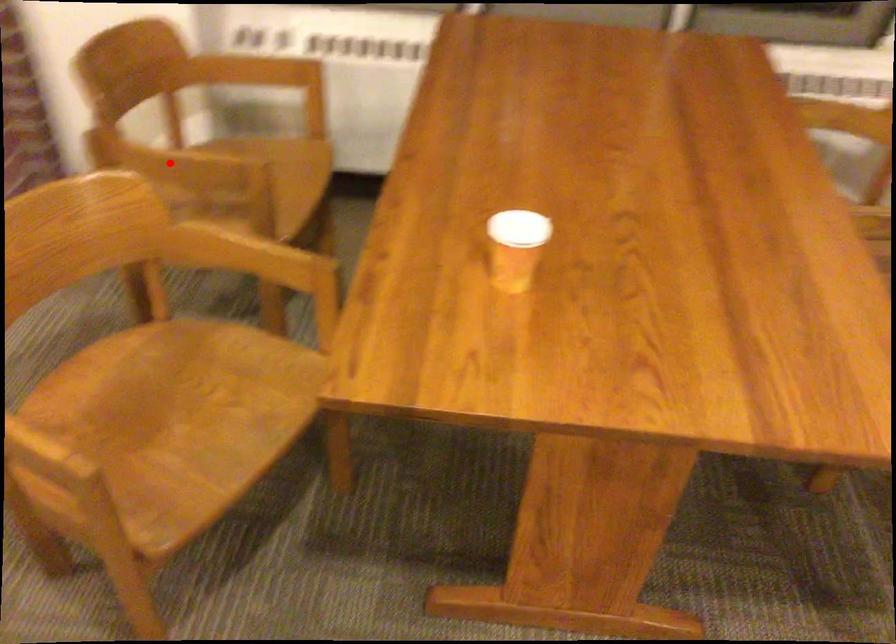
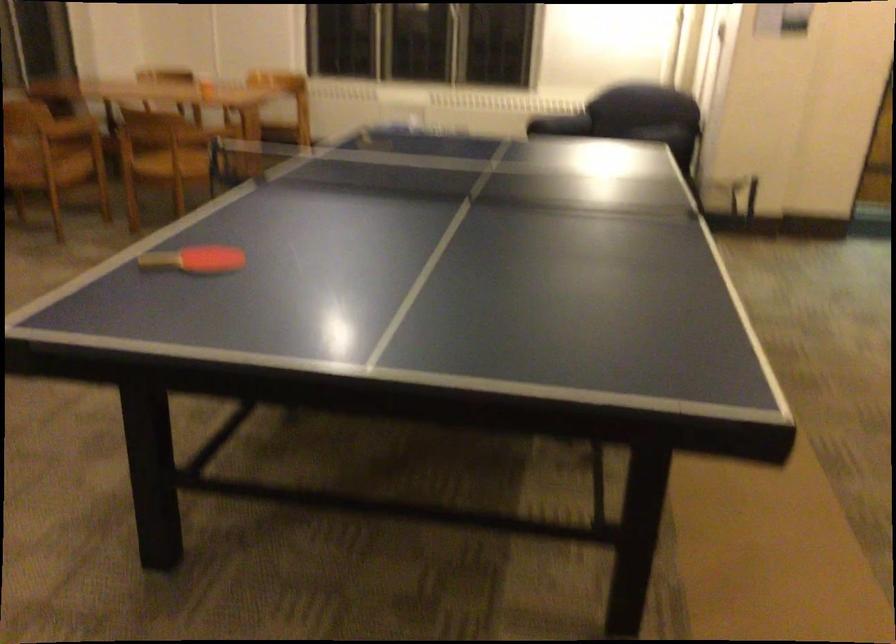
Question: I am providing you with two images of the same scene from different viewpoints. A red point is marked on the first image. Is the red point's position out of view in image 2?

Choices:
 (A) Yes
 (B) No

Answer: (A)